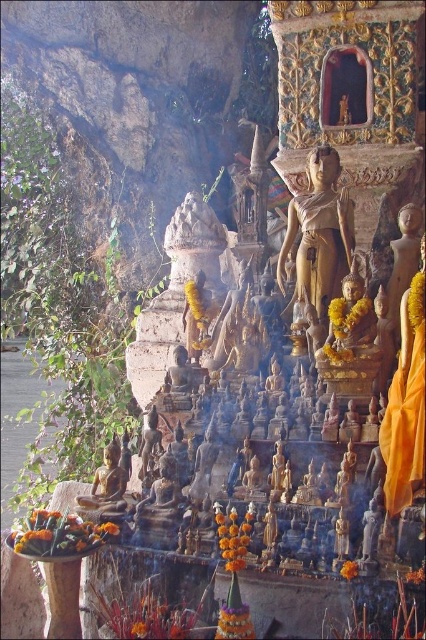
You are a tourist standing in front of the gold polished statue at center at a temple. Your friend is standing 30 meters behind you. Can you hear your friend if they shout?

The distance between you and your friend is 30 meters. Since the gold polished statue at center is 27.18 meters away from the viewer, your friend is 30 meters behind you, making the total distance between you and your friend 27.18 meters plus 30 meters, which is 57.18 meters. Shouting can typically be heard up to 100 meters in ideal conditions, so yes, you can likely hear your friend if they shout.

You are standing in front of the temple scene described. There is a point marked at coordinates (319,234). Which object in the scene is located at this point?

The point at coordinates (319,234) indicates the location of the gold polished statue at center.

Based on the photo, you are a visitor to the temple and want to take a photo of both the gold polished statue at center and the bronze statue at lower left. Based on their positions, which statue should you focus on first to ensure both are in the frame?

The gold polished statue at center is positioned on the right side of bronze statue at lower left, so you should focus on the bronze statue at lower left first to ensure both are in the frame.